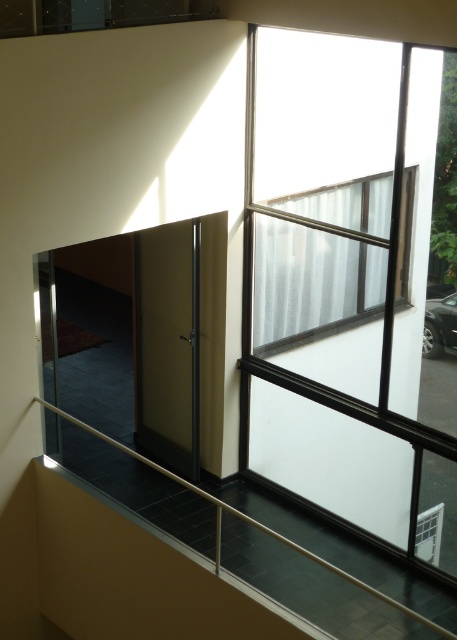
You are standing in the room and want to look outside through the clear glass window at upper center. Can you see the metallic silver railing at lower center blocking your view?

The clear glass window at upper center is further to the viewer than the metallic silver railing at lower center, so the railing is closer to you and would block your view of the window.

You are standing in the room and want to move from the point at coordinates point (330,204) to the point at coordinates point (197,492). Which direction should you move to get closer to your destination?

To move from point (330,204) to point (197,492), you should move towards the upper right direction since point (197,492) is located in the upper right relative to point (330,204).

Based on the photo, you are an interior designer assessing the natural light in the room. You notice the clear glass window at upper right and the clear glass window at upper center. Which window allows more natural light into the room?

The clear glass window at upper right is much taller than the clear glass window at upper center, so it allows more natural light into the room.